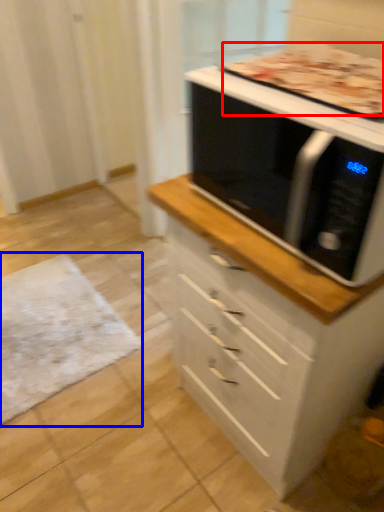
Question: Among these objects, which one is farthest to the camera, pizza (highlighted by a red box) or mat (highlighted by a blue box)?

Choices:
 (A) pizza
 (B) mat

Answer: (B)